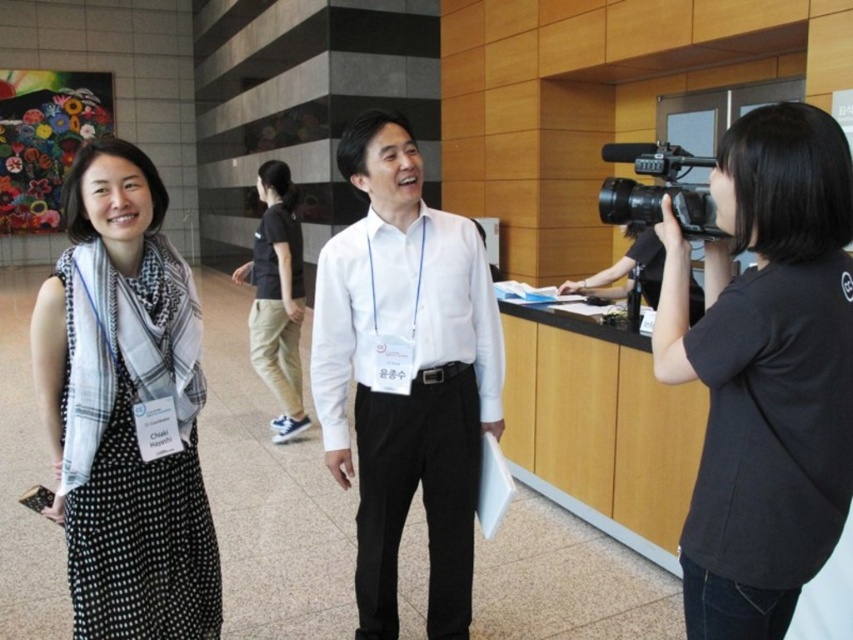
You are setting up for a photo shoot in the conference space. The black matte camera at right needs to be positioned at point 0.6, 0.9 to capture the best angle. Is the current position of the camera suitable?

The black matte camera at right is located at point (764,371), which is very close to the desired position of (767,384). The slight difference in coordinates means it is nearly in the correct spot and likely suitable for capturing the best angle.

You are setting up equipment for a live stream and have both the black matte camera at right and the black plastic video camera at right. Which one should you choose if you need a smaller device to fit in your backpack?

The black matte camera at right is smaller than the black plastic video camera at right, so you should choose the black matte camera at right to fit in your backpack.